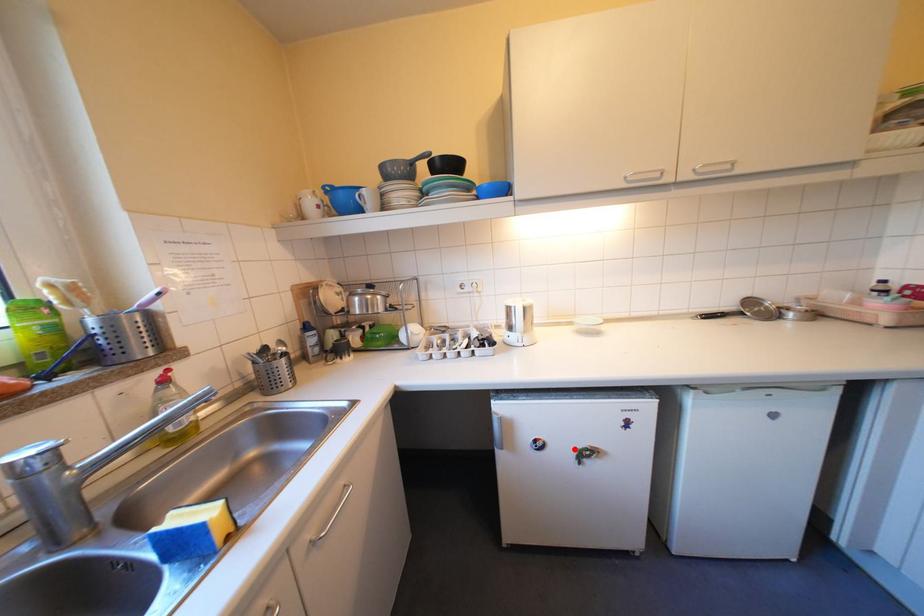
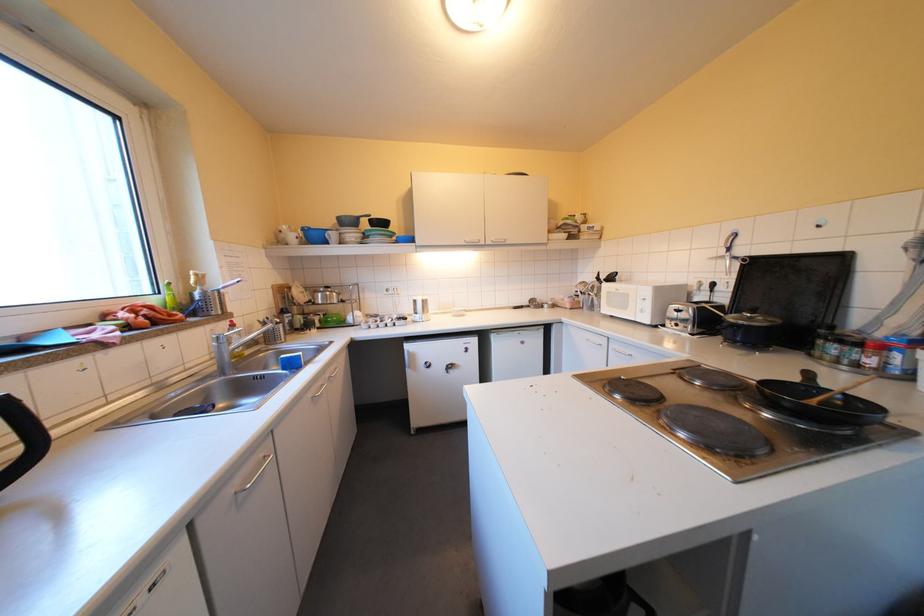
Question: I am providing you with two images of the same scene from different viewpoints. A red point is shown in image1. For the corresponding object point in image2, is it positioned nearer or farther from the camera?

Choices:
 (A) Nearer
 (B) Farther

Answer: (B)